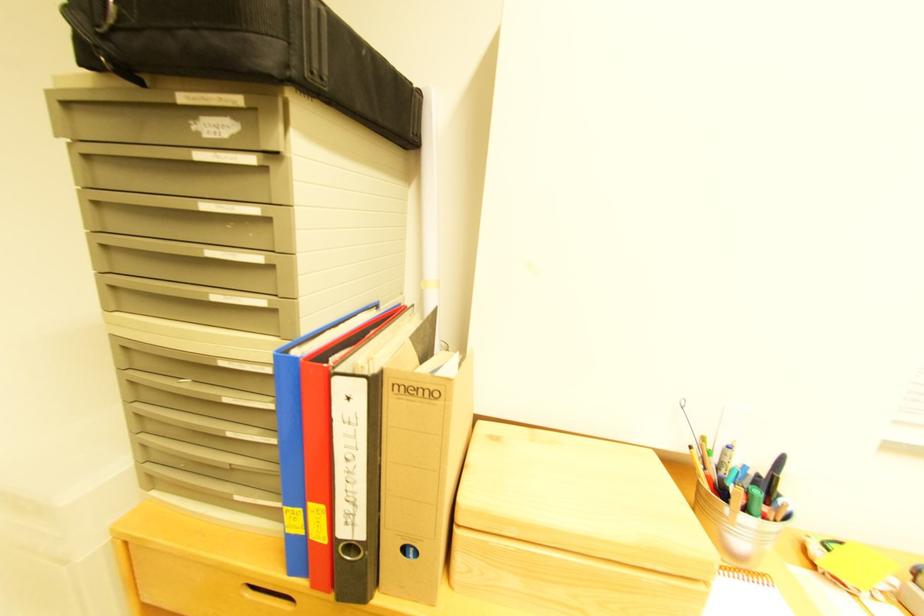
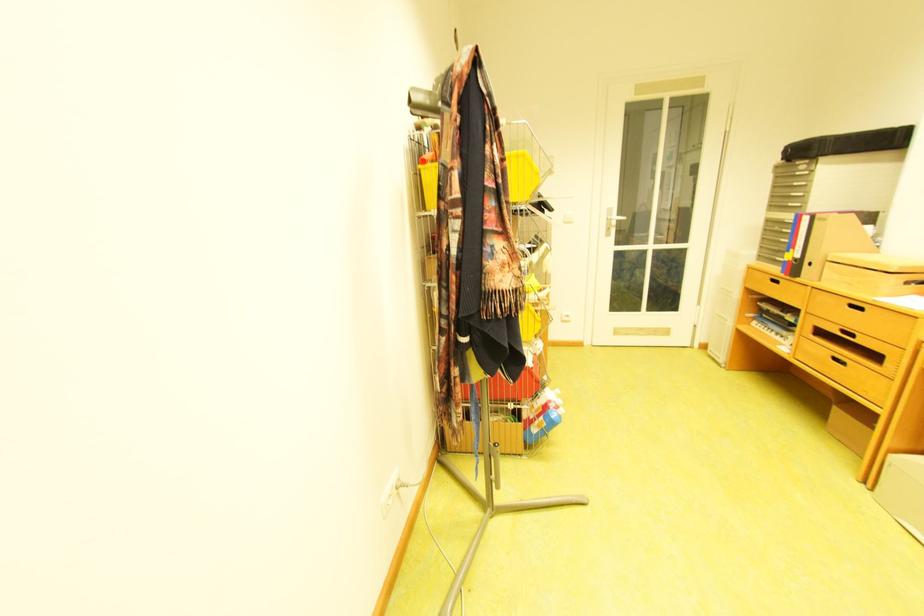
Locate, in the second image, the point that corresponds to pixel 195 100 in the first image.

(808, 164)